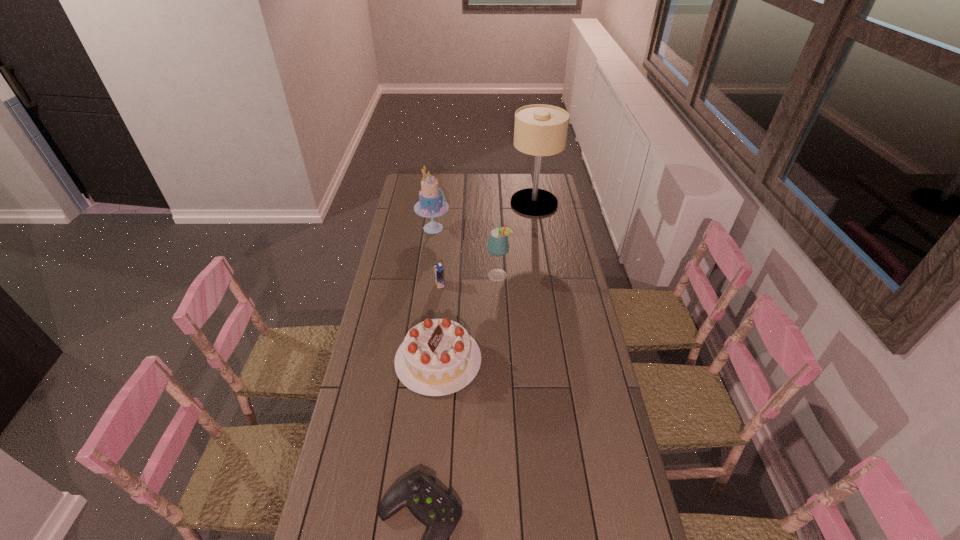
At what (x,y) coordinates should I click in order to perform the action: click on the tallest object. Please return your answer as a coordinate pair (x, y). Looking at the image, I should click on (540, 130).

What are the coordinates of `the rightmost object` in the screenshot? It's located at (540, 130).

You are a GUI agent. You are given a task and a screenshot of the screen. Output one action in this format:
    pyautogui.click(x=<x>, y=<y>)
    Task: Click on the cake
    This screenshot has height=540, width=960.
    Given the screenshot: What is the action you would take?
    pyautogui.click(x=432, y=203)

Where is `alcohol`? The image size is (960, 540). alcohol is located at coordinates pos(498,245).

The width and height of the screenshot is (960, 540). Find the location of `the second nearest object`. the second nearest object is located at coordinates (438, 357).

Where is `birthday cake`? This screenshot has height=540, width=960. birthday cake is located at coordinates (438, 357).

Identify the location of orange_juice. The width and height of the screenshot is (960, 540). (438, 269).

What are the coordinates of `free region located 0.160m on the front of the table lamp` in the screenshot? It's located at (540, 234).

Identify the location of vacant space located 0.130m with a ladder on the side of the fifth nearest object. The height and width of the screenshot is (540, 960). (475, 228).

The image size is (960, 540). Find the location of `vacant space situated on the right of the fifth object from left to right`. vacant space situated on the right of the fifth object from left to right is located at coordinates (566, 275).